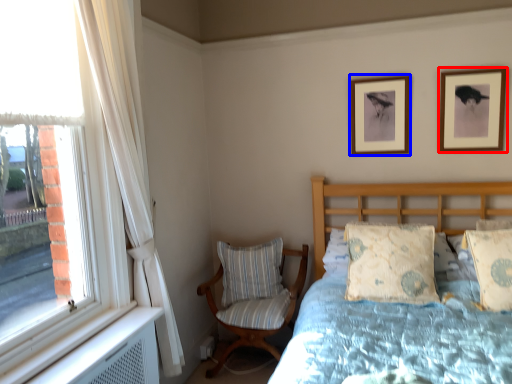
Question: Which object is closer to the camera taking this photo, picture frame (highlighted by a red box) or picture frame (highlighted by a blue box)?

Choices:
 (A) picture frame
 (B) picture frame

Answer: (A)